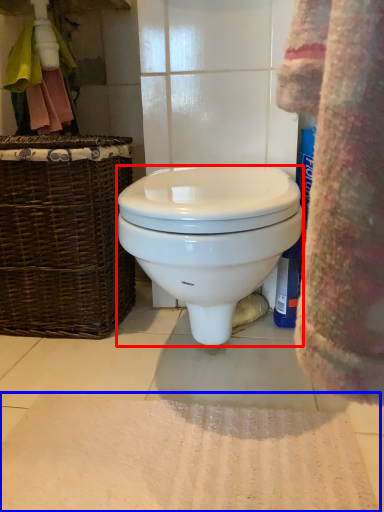
Question: Among these objects, which one is nearest to the camera, toilet (highlighted by a red box) or bath mat (highlighted by a blue box)?

Choices:
 (A) toilet
 (B) bath mat

Answer: (B)